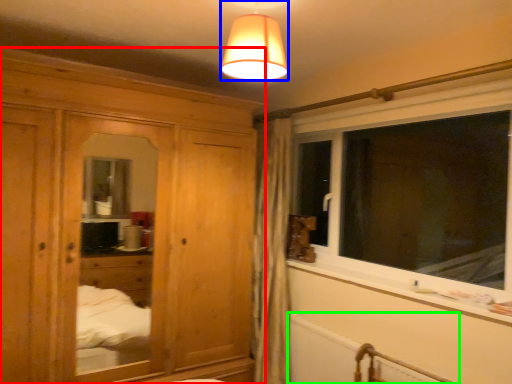
Question: Which object is the closest to the cabinetry (highlighted by a red box)? Choose among these: lamp (highlighted by a blue box) or radiator (highlighted by a green box).

Choices:
 (A) lamp
 (B) radiator

Answer: (B)